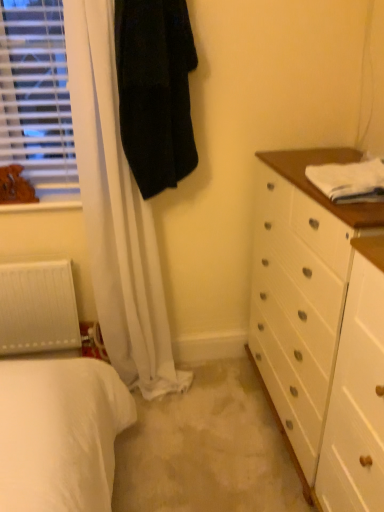
Question: From a real-world perspective, is white cotton towel at upper right on top of brown leather dog at left?

Choices:
 (A) yes
 (B) no

Answer: (A)

Question: Would you say white cotton towel at upper right is outside brown leather dog at left?

Choices:
 (A) yes
 (B) no

Answer: (A)

Question: Is there a large distance between white cotton towel at upper right and brown leather dog at left?

Choices:
 (A) no
 (B) yes

Answer: (B)

Question: Does white cotton towel at upper right have a smaller size compared to brown leather dog at left?

Choices:
 (A) no
 (B) yes

Answer: (A)

Question: Is white cotton towel at upper right wider than brown leather dog at left?

Choices:
 (A) yes
 (B) no

Answer: (A)

Question: From a real-world perspective, is white cotton towel at upper right beneath brown leather dog at left?

Choices:
 (A) yes
 (B) no

Answer: (B)

Question: Is black fuzzy coat at upper left taller than wooden frame at left?

Choices:
 (A) no
 (B) yes

Answer: (B)

Question: Is wooden frame at left inside black fuzzy coat at upper left?

Choices:
 (A) no
 (B) yes

Answer: (A)

Question: Can you confirm if black fuzzy coat at upper left is smaller than wooden frame at left?

Choices:
 (A) yes
 (B) no

Answer: (B)

Question: From the image's perspective, is black fuzzy coat at upper left over wooden frame at left?

Choices:
 (A) no
 (B) yes

Answer: (B)

Question: Does black fuzzy coat at upper left have a larger size compared to wooden frame at left?

Choices:
 (A) yes
 (B) no

Answer: (A)

Question: Is black fuzzy coat at upper left wider than wooden frame at left?

Choices:
 (A) no
 (B) yes

Answer: (A)

Question: Would you consider black fuzzy coat at upper left to be distant from white matte radiator at lower left?

Choices:
 (A) no
 (B) yes

Answer: (A)